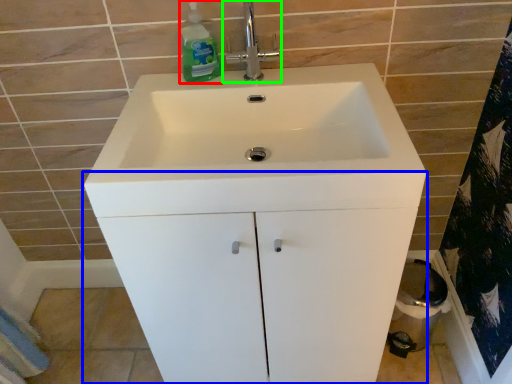
Question: Which object is positioned closest to cleaning product (highlighted by a red box)? Select from bathroom cabinet (highlighted by a blue box) and tap (highlighted by a green box).

Choices:
 (A) bathroom cabinet
 (B) tap

Answer: (B)